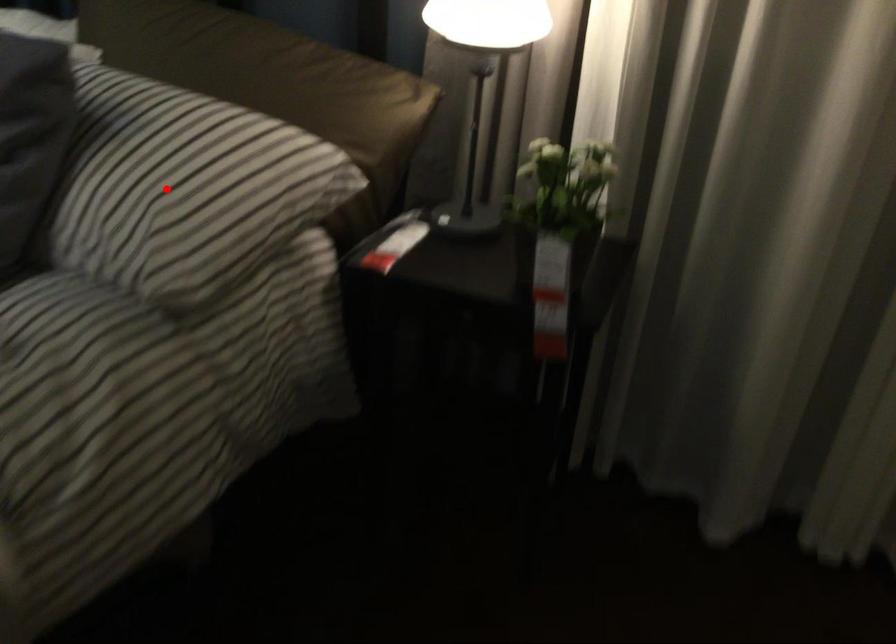
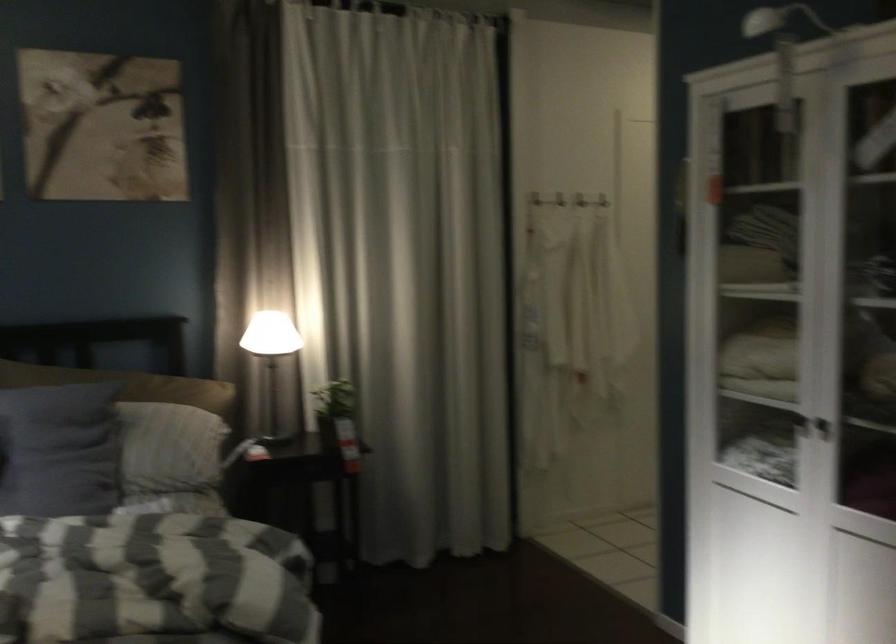
Find the pixel in the second image that matches the highlighted location in the first image.

(173, 442)